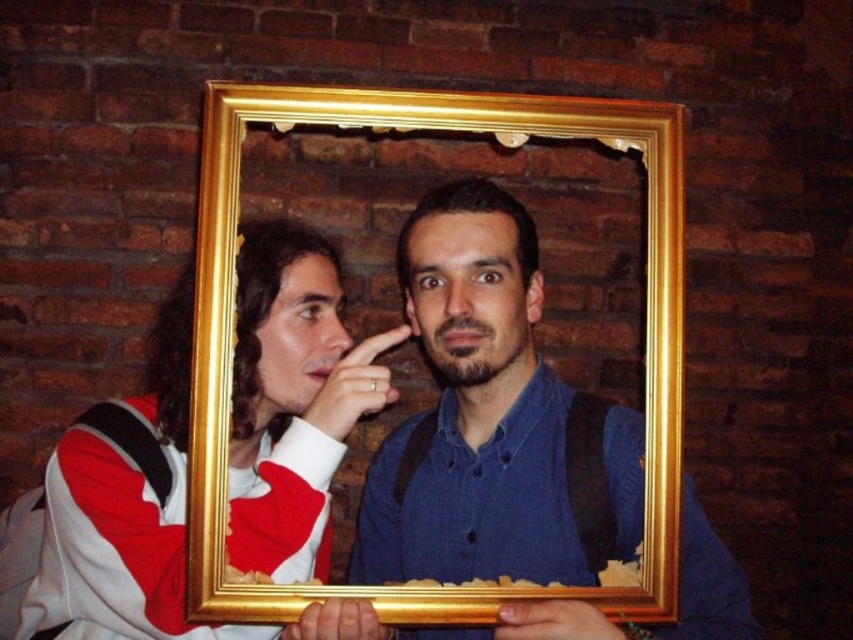
Between point (73, 442) and point (254, 586), which one is positioned behind?

Positioned behind is point (73, 442).

Locate an element on the screen. matte white jacket at left is located at coordinates (293, 400).

Between point (155, 532) and point (439, 609), which one is positioned in front?

Point (439, 609)

Where is `matte white jacket at left`? This screenshot has width=853, height=640. matte white jacket at left is located at coordinates (293, 400).